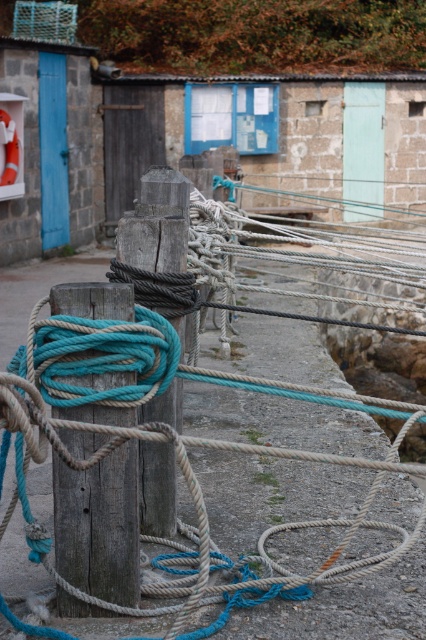
Who is positioned more to the right, wooden post at center or weathered wood post at center?

Positioned to the right is weathered wood post at center.

Is the position of wooden post at center more distant than that of weathered wood post at center?

No.

What do you see at coordinates (98, 525) in the screenshot?
I see `wooden post at center` at bounding box center [98, 525].

I want to click on wooden post at center, so click(x=98, y=525).

Is teal rope at center to the left of weathered wood post at center from the viewer's perspective?

No, teal rope at center is not to the left of weathered wood post at center.

Locate an element on the screen. The image size is (426, 640). teal rope at center is located at coordinates (86, 483).

Where is `teal rope at center`? The width and height of the screenshot is (426, 640). teal rope at center is located at coordinates (86, 483).

Based on the photo, who is positioned more to the right, teal rope at center or wooden post at center?

teal rope at center

Who is lower down, teal rope at center or wooden post at center?

teal rope at center is below.

You are a GUI agent. You are given a task and a screenshot of the screen. Output one action in this format:
    pyautogui.click(x=<x>, y=<y>)
    Task: Click on the teal rope at center
    
    Given the screenshot: What is the action you would take?
    pyautogui.click(x=86, y=483)